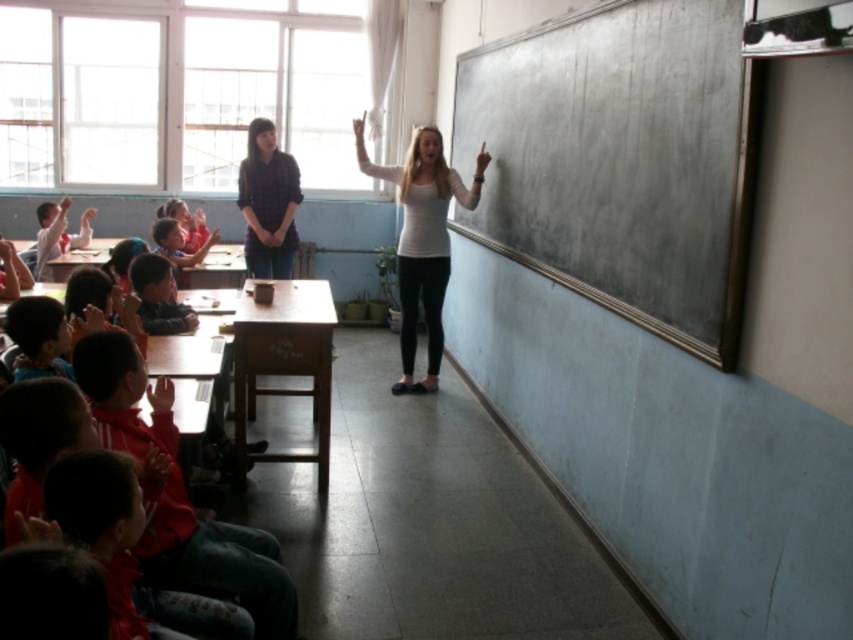
Question: Is smooth blackboard at right to the right of red jacket at lower left from the viewer's perspective?

Choices:
 (A) yes
 (B) no

Answer: (A)

Question: Estimate the real-world distances between objects in this image. Which object is closer to the smooth skin child at lower left?

Choices:
 (A) red jacket at lower left
 (B) white matte shirt at center

Answer: (A)

Question: Can you confirm if red jacket at lower left is positioned to the left of matte blue shirt at center?

Choices:
 (A) yes
 (B) no

Answer: (B)

Question: Which object appears farthest from the camera in this image?

Choices:
 (A) smooth skin child at lower left
 (B) matte blue shirt at center

Answer: (B)

Question: Is red jacket at lower left positioned before matte blue shirt at center?

Choices:
 (A) yes
 (B) no

Answer: (A)

Question: Which point appears closest to the camera in this image?

Choices:
 (A) (137, 285)
 (B) (154, 442)

Answer: (B)